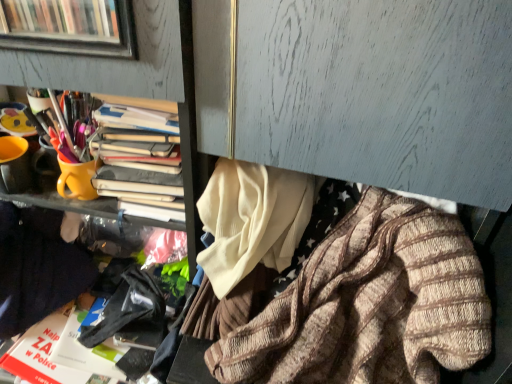
Question: Is yellow matte cup at upper left to the right of knitted wool sweater at lower right, placed as the first clothing when sorted from right to left, from the viewer's perspective?

Choices:
 (A) yes
 (B) no

Answer: (B)

Question: Is yellow matte cup at upper left behind knitted wool sweater at lower right, placed as the first clothing when sorted from right to left?

Choices:
 (A) no
 (B) yes

Answer: (B)

Question: From a real-world perspective, does yellow matte cup at upper left stand above knitted wool sweater at lower right, which is counted as the 2th clothing, starting from the left?

Choices:
 (A) no
 (B) yes

Answer: (B)

Question: Could you tell me if yellow matte cup at upper left is facing knitted wool sweater at lower right, which is counted as the 2th clothing, starting from the left?

Choices:
 (A) no
 (B) yes

Answer: (A)

Question: Is yellow matte cup at upper left far from knitted wool sweater at lower right, placed as the first clothing when sorted from right to left?

Choices:
 (A) yes
 (B) no

Answer: (B)

Question: Considering the relative positions of knitted wool sweater at lower right, placed as the first clothing when sorted from right to left, and yellow matte cup at upper left in the image provided, is knitted wool sweater at lower right, placed as the first clothing when sorted from right to left, to the left or to the right of yellow matte cup at upper left?

Choices:
 (A) left
 (B) right

Answer: (B)

Question: Does point (368, 322) appear closer or farther from the camera than point (169, 102)?

Choices:
 (A) farther
 (B) closer

Answer: (A)

Question: Is knitted wool sweater at lower right, which is counted as the 2th clothing, starting from the left, bigger or smaller than yellow matte cup at upper left?

Choices:
 (A) big
 (B) small

Answer: (A)

Question: Is knitted wool sweater at lower right, which is counted as the 2th clothing, starting from the left, inside the boundaries of yellow matte cup at upper left, or outside?

Choices:
 (A) inside
 (B) outside

Answer: (B)

Question: From the image's perspective, is knitted wool sweater at lower right, placed as the first clothing when sorted from right to left, above or below dark blue sweater at left, which ranks as the first clothing in left-to-right order?

Choices:
 (A) below
 (B) above

Answer: (A)

Question: Which is correct: knitted wool sweater at lower right, which is counted as the 2th clothing, starting from the left, is inside dark blue sweater at left, acting as the second clothing starting from the right, or outside of it?

Choices:
 (A) outside
 (B) inside

Answer: (A)

Question: Is knitted wool sweater at lower right, placed as the first clothing when sorted from right to left, taller or shorter than dark blue sweater at left, acting as the second clothing starting from the right?

Choices:
 (A) short
 (B) tall

Answer: (B)

Question: In the image, is knitted wool sweater at lower right, which is counted as the 2th clothing, starting from the left, positioned in front of or behind dark blue sweater at left, which ranks as the first clothing in left-to-right order?

Choices:
 (A) behind
 (B) front

Answer: (B)

Question: Is yellow matte cup at upper left wider or thinner than dark blue sweater at left, which ranks as the first clothing in left-to-right order?

Choices:
 (A) thin
 (B) wide

Answer: (A)

Question: Is yellow matte cup at upper left bigger or smaller than dark blue sweater at left, acting as the second clothing starting from the right?

Choices:
 (A) big
 (B) small

Answer: (B)